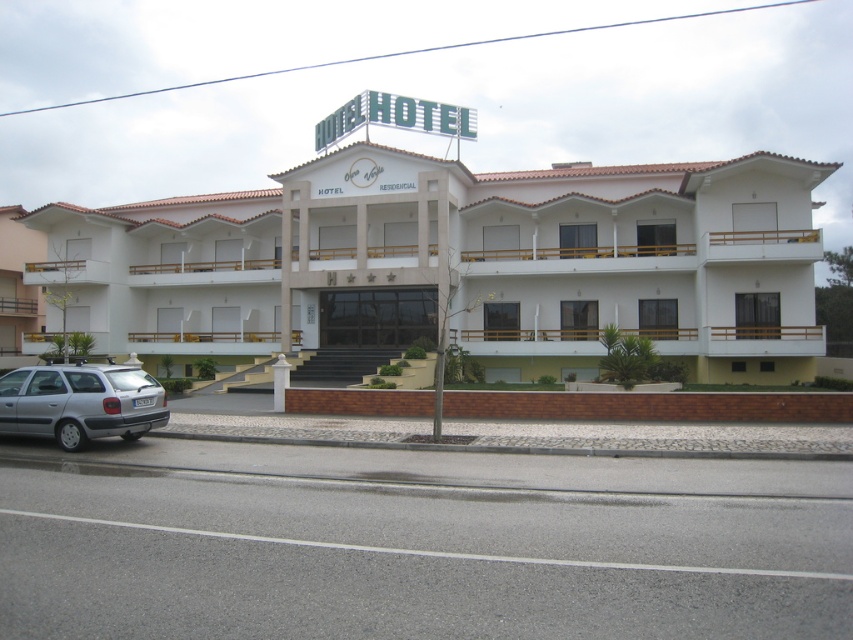
Question: Is white matte building at center wider than silver metallic car at lower left?

Choices:
 (A) no
 (B) yes

Answer: (B)

Question: Which of the following is the farthest from the observer?

Choices:
 (A) [x=584, y=320]
 (B) [x=142, y=378]

Answer: (A)

Question: Is white matte building at center thinner than silver metallic car at lower left?

Choices:
 (A) no
 (B) yes

Answer: (A)

Question: Is white matte building at center smaller than silver metallic car at lower left?

Choices:
 (A) no
 (B) yes

Answer: (A)

Question: Among these points, which one is nearest to the camera?

Choices:
 (A) (322, 195)
 (B) (50, 388)

Answer: (B)